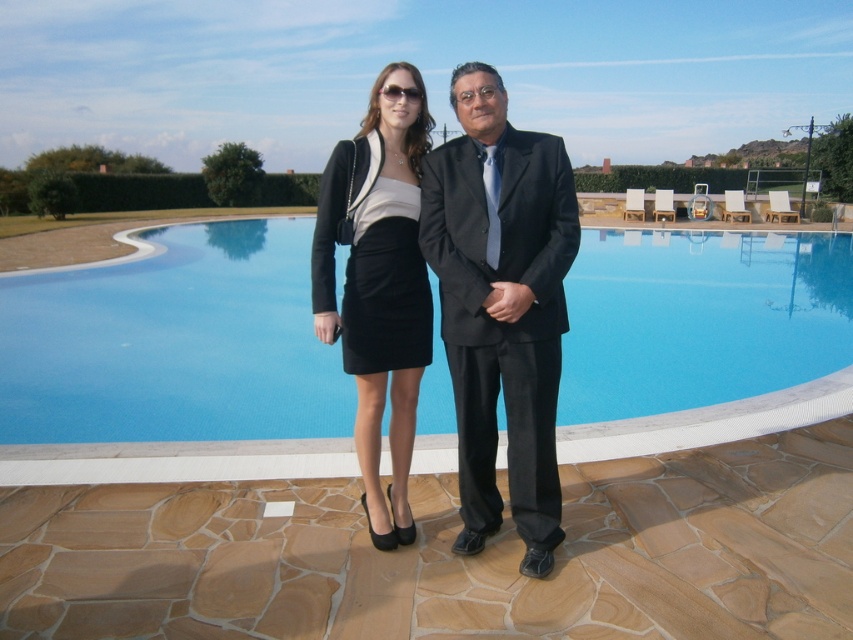
Question: Which of the following is the closest to the observer?

Choices:
 (A) (395, 236)
 (B) (546, 220)
 (C) (225, 275)

Answer: (B)

Question: Does blue glass swimming pool at center have a smaller size compared to matte black suit at center?

Choices:
 (A) no
 (B) yes

Answer: (A)

Question: Among these points, which one is nearest to the camera?

Choices:
 (A) coord(457,80)
 (B) coord(357,262)
 (C) coord(767,276)

Answer: (A)

Question: Can you confirm if matte black suit at center is wider than black satin dress at center?

Choices:
 (A) yes
 (B) no

Answer: (A)

Question: Can you confirm if blue glass swimming pool at center is positioned below matte black suit at center?

Choices:
 (A) yes
 (B) no

Answer: (B)

Question: Which object is the closest to the black satin dress at center?

Choices:
 (A) matte black suit at center
 (B) matte black skirt at center
 (C) blue glass swimming pool at center

Answer: (B)